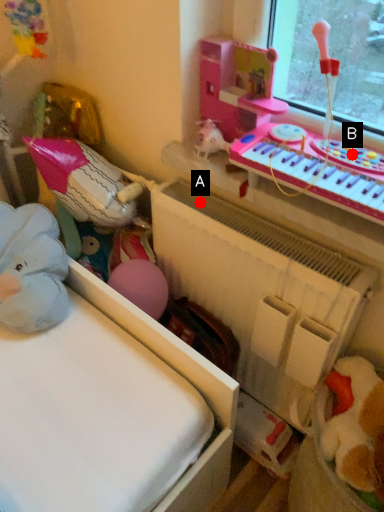
Question: Two points are circled on the image, labeled by A and B beside each circle. Among these points, which one is nearest to the camera?

Choices:
 (A) A is closer
 (B) B is closer

Answer: (B)